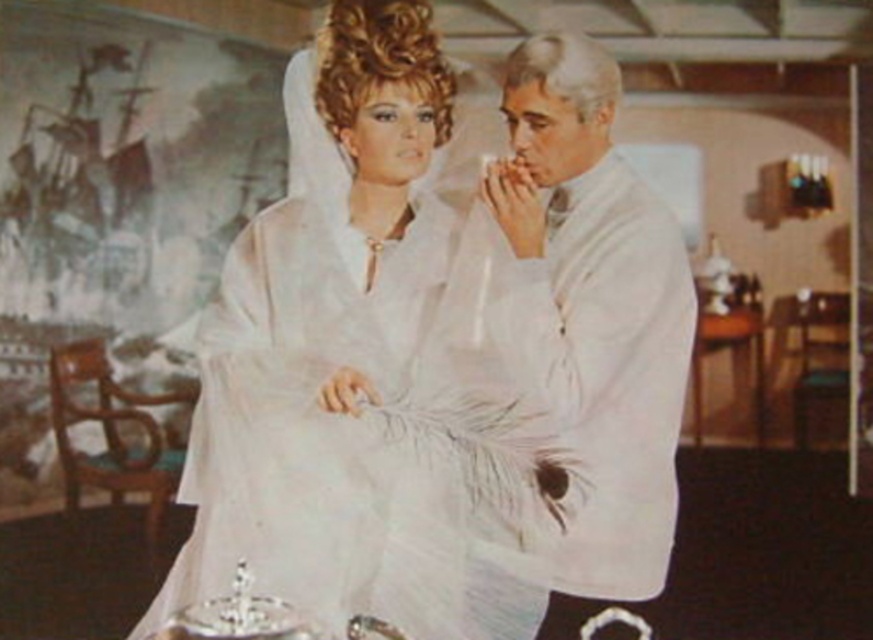
You are a photographer standing 5 feet away from the camera. You want to take a photo of the white satin dress at center. Is the camera within your reach?

The white satin dress at center and camera are 7.11 feet apart. Since you are 5 feet away from the camera, the total distance between you and the dress is 12.11 feet, which is too far to reach the camera.

You are a photographer trying to capture a clear photo of both the white satin dress at center and the white matte coat at center. Since the camera can only focus on one object at a time, which object should you choose to ensure the other is still partially visible in the frame?

The white satin dress at center is wider than the white matte coat at center, so you should focus on the white satin dress at center to ensure the white matte coat at center is still partially visible in the frame.

You are a photographer setting up a shoot in the room described. You need to position a spotlight at coordinates point A at 0.4, 0.5. Will the spotlight hit the white satin dress at center?

The white satin dress at center is located at point (440, 353), which is further to the right compared to the spotlight at point A at (436, 256). Therefore, the spotlight will not hit the white satin dress at center.